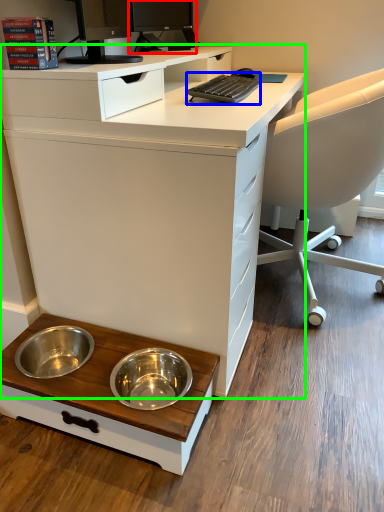
Question: Which object is positioned closest to desktop computer (highlighted by a red box)? Select from computer keyboard (highlighted by a blue box) and desk (highlighted by a green box).

Choices:
 (A) computer keyboard
 (B) desk

Answer: (A)